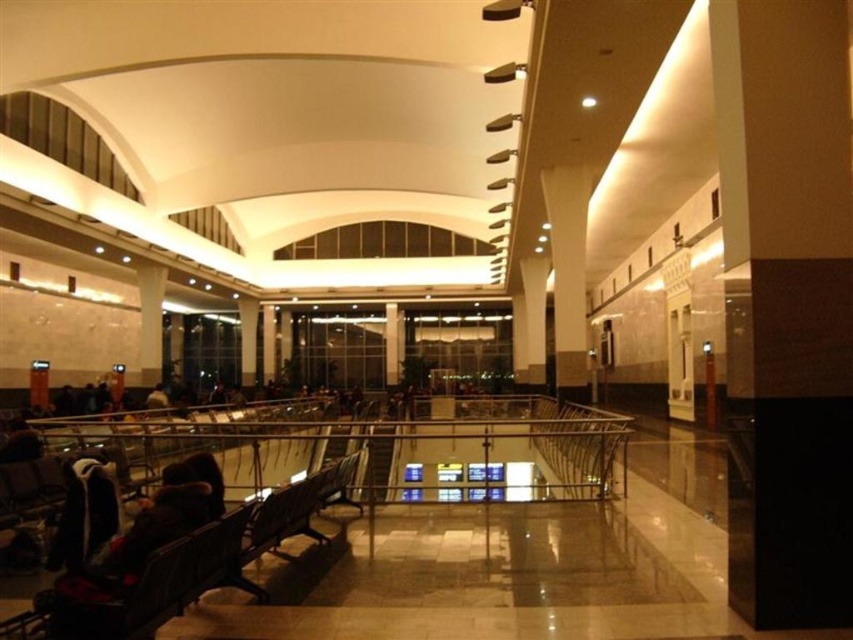
Question: Which point is closer to the camera taking this photo?

Choices:
 (A) click(x=160, y=388)
 (B) click(x=575, y=305)

Answer: (B)

Question: In this image, where is black polished stone pillar at right located relative to white glossy pillar at center?

Choices:
 (A) below
 (B) above

Answer: (A)

Question: Which object is positioned farthest from the black polished stone pillar at right?

Choices:
 (A) white glossy pillar at center
 (B) dark brown leather jacket at center

Answer: (B)

Question: Which point is farther to the camera?

Choices:
 (A) white glossy pillar at center
 (B) dark brown leather jacket at center
 (C) black polished stone pillar at right

Answer: (B)

Question: Can you confirm if white glossy pillar at center is positioned to the right of dark brown leather jacket at center?

Choices:
 (A) yes
 (B) no

Answer: (A)

Question: In this image, where is black polished stone pillar at right located relative to dark brown leather jacket at center?

Choices:
 (A) above
 (B) below

Answer: (A)